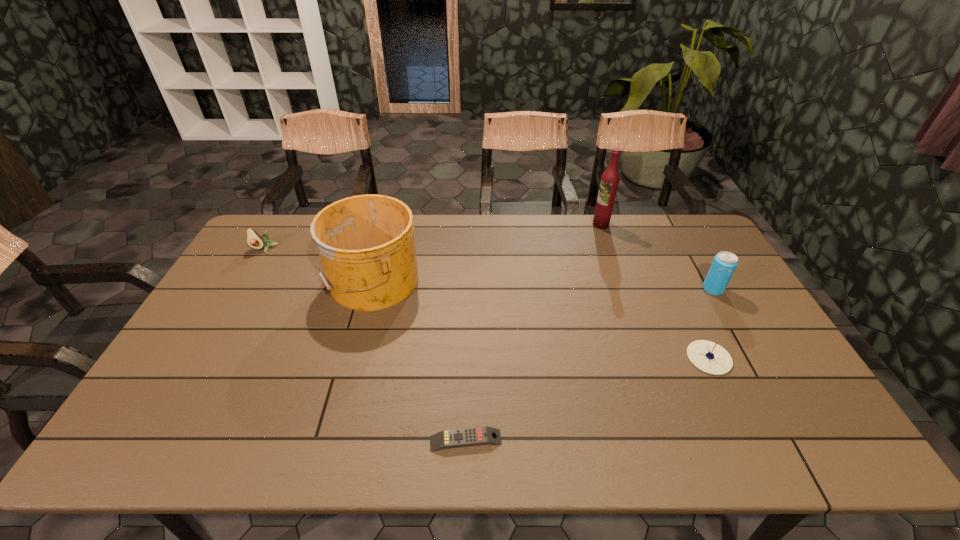
This screenshot has width=960, height=540. Identify the location of liquor present at the far edge. tap(609, 183).

Find the location of `bucket that is at the far edge`. bucket that is at the far edge is located at coordinates (366, 245).

You are a GUI agent. You are given a task and a screenshot of the screen. Output one action in this format:
    pyautogui.click(x=<x>, y=<y>)
    Task: Click on the avocado that is positioned at the far edge
    This screenshot has width=960, height=540.
    Given the screenshot: What is the action you would take?
    pyautogui.click(x=254, y=240)

The width and height of the screenshot is (960, 540). I want to click on object located at the near edge, so click(x=476, y=436).

Where is `object present at the left edge`? The height and width of the screenshot is (540, 960). object present at the left edge is located at coordinates (254, 240).

This screenshot has height=540, width=960. I want to click on soda can located at the right edge, so click(x=724, y=264).

Locate an element on the screen. The height and width of the screenshot is (540, 960). compass that is at the right edge is located at coordinates (710, 357).

Where is `object that is at the far left corner`? This screenshot has height=540, width=960. object that is at the far left corner is located at coordinates (254, 240).

The height and width of the screenshot is (540, 960). In the image, there is a desktop. Identify the location of vacant space at the far edge. (502, 232).

The height and width of the screenshot is (540, 960). Find the location of `free region at the near edge of the desktop`. free region at the near edge of the desktop is located at coordinates (537, 436).